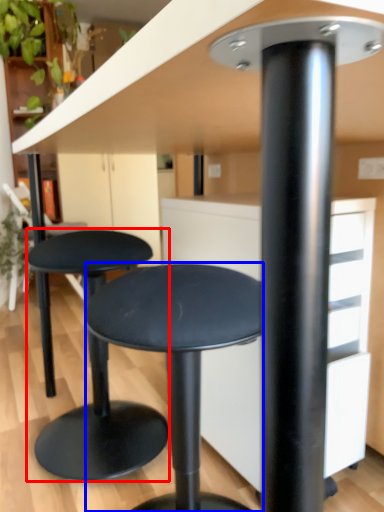
Question: Which of the following is the closest to the observer, stool (highlighted by a red box) or stool (highlighted by a blue box)?

Choices:
 (A) stool
 (B) stool

Answer: (B)